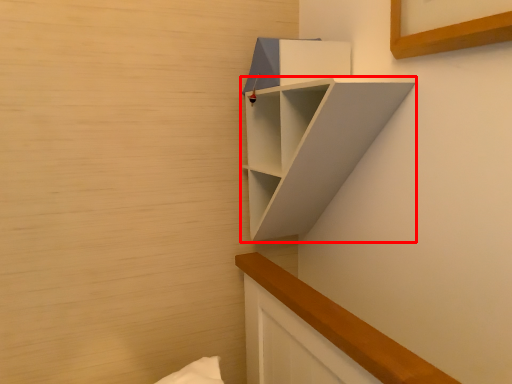
Question: In this image, where is shelf (annotated by the red box) located relative to cabinet?

Choices:
 (A) right
 (B) left

Answer: (A)